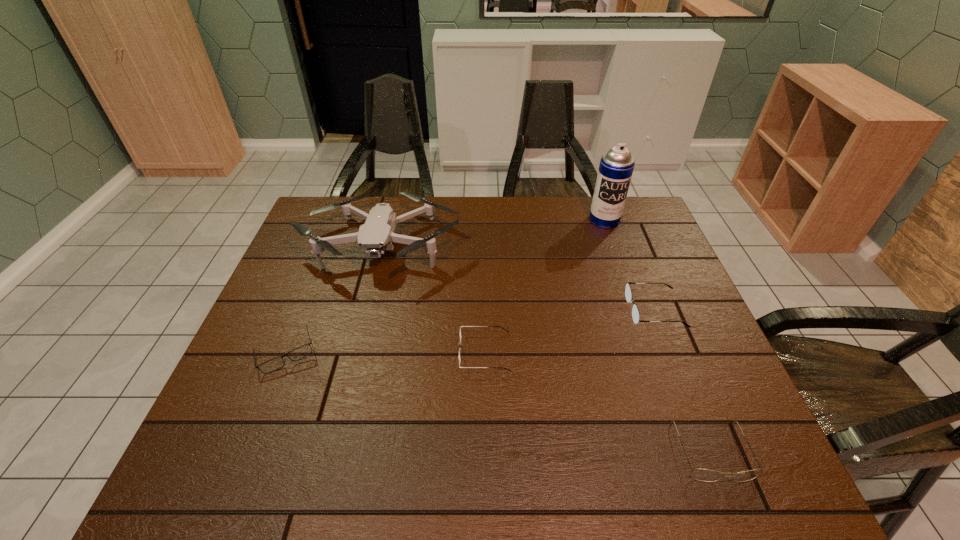
Where is `aerosol can`? The width and height of the screenshot is (960, 540). aerosol can is located at coordinates (616, 167).

Where is `drone`? The height and width of the screenshot is (540, 960). drone is located at coordinates (375, 236).

Where is `the farthest spectacles`? This screenshot has width=960, height=540. the farthest spectacles is located at coordinates (628, 293).

Find the location of `the leftmost spectacles`. the leftmost spectacles is located at coordinates (301, 352).

Find the location of a particular element. Image resolution: width=960 pixels, height=540 pixels. the third spectacles from right to left is located at coordinates (460, 326).

This screenshot has height=540, width=960. I want to click on the nearest object, so click(705, 475).

Where is `free space located on the label side of the tallest object`? This screenshot has height=540, width=960. free space located on the label side of the tallest object is located at coordinates (616, 253).

What are the coordinates of `vacant region located with a camera at the front of the fifth shortest object` in the screenshot? It's located at (350, 361).

In order to click on free space located on the lenses of the third farthest object in this screenshot , I will do `click(606, 310)`.

The width and height of the screenshot is (960, 540). Find the location of `vacant space located on the lenses of the third farthest object`. vacant space located on the lenses of the third farthest object is located at coordinates coord(602,310).